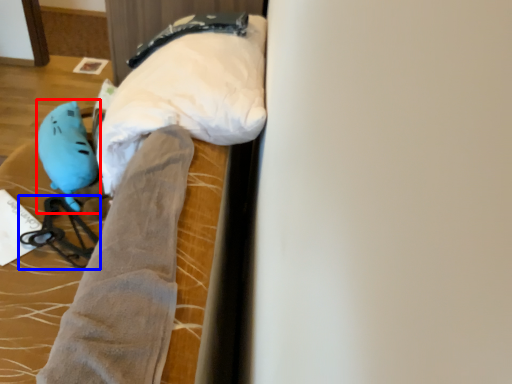
Question: Among these objects, which one is nearest to the camera, toy (highlighted by a red box) or twin (highlighted by a blue box)?

Choices:
 (A) toy
 (B) twin

Answer: (B)